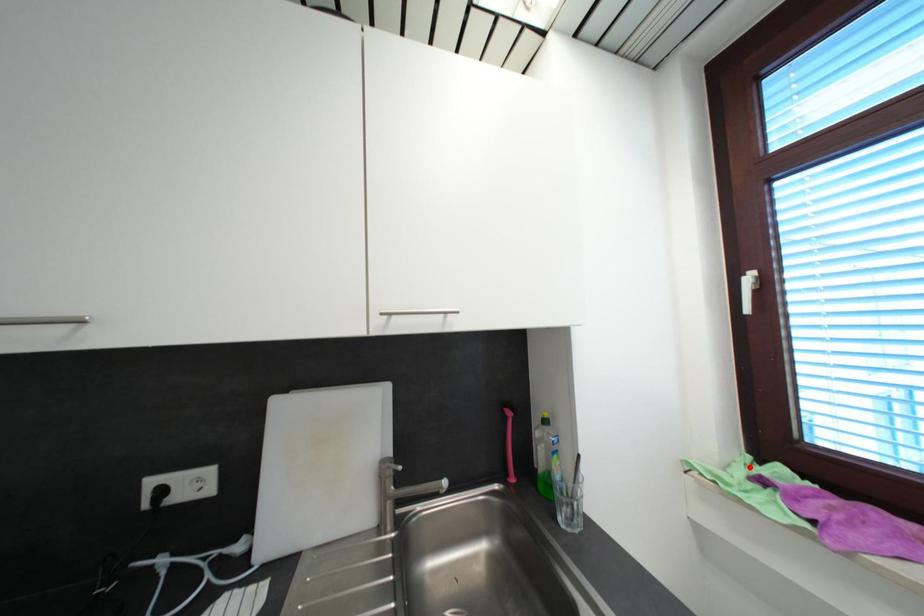
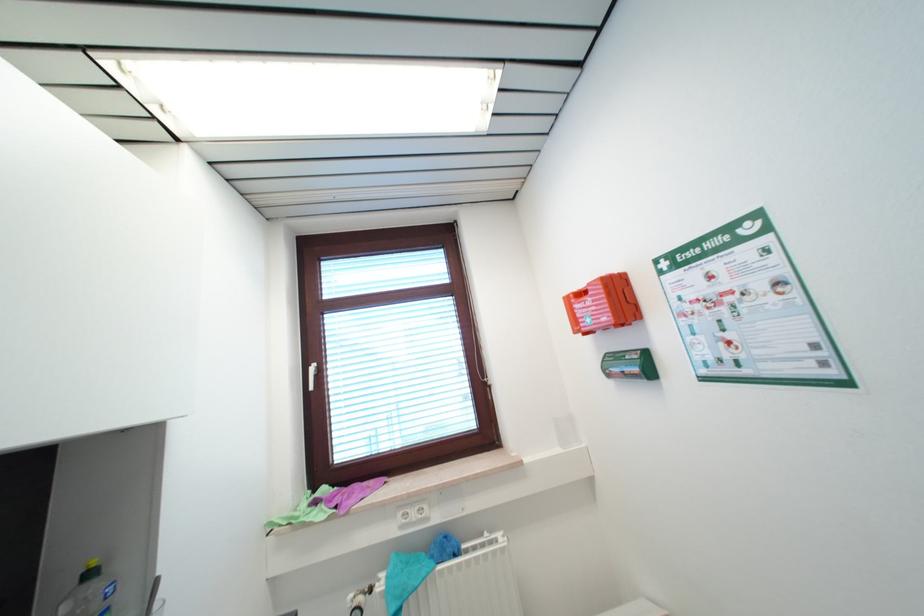
Question: I am providing you with two images of the same scene from different viewpoints. A red point is marked on the first image. Can you still see the location of the red point in image 2?

Choices:
 (A) Yes
 (B) No

Answer: (A)